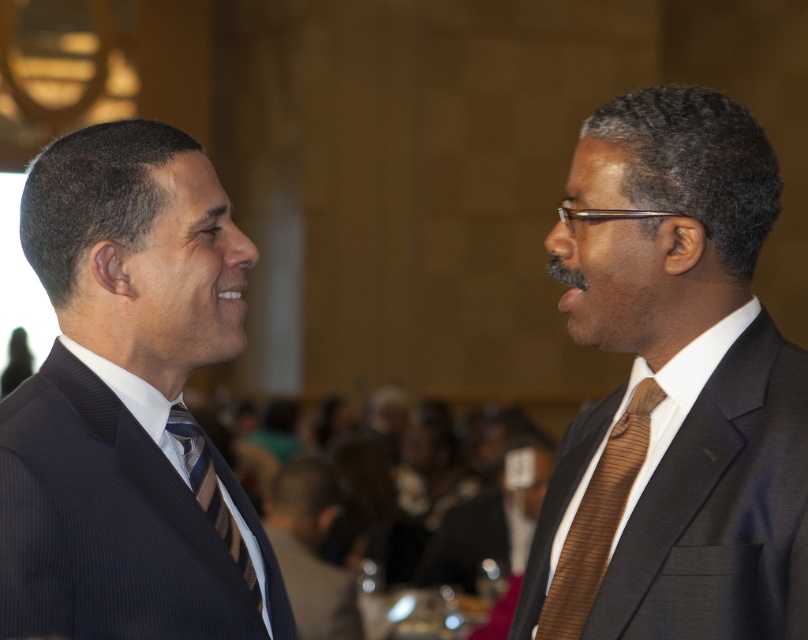
You are a photographer at a formal event. You need to capture a closeup shot of the ties worn by the two men. Which tie, the brown textured tie at right or the striped fabric tie at left, will appear larger in your photo if you focus on them equally?

The brown textured tie at right is taller than the striped fabric tie at left, so when focused equally, the brown textured tie at right will appear larger in the photo.

You are a photographer at the event and want to capture a closeup of both the brown textured tie at right and the brown striped tie at right. Which tie should you zoom in on first to ensure it fills the frame better?

The brown textured tie at right is bigger than the brown striped tie at right, so you should zoom in on the brown textured tie at right first to ensure it fills the frame better.